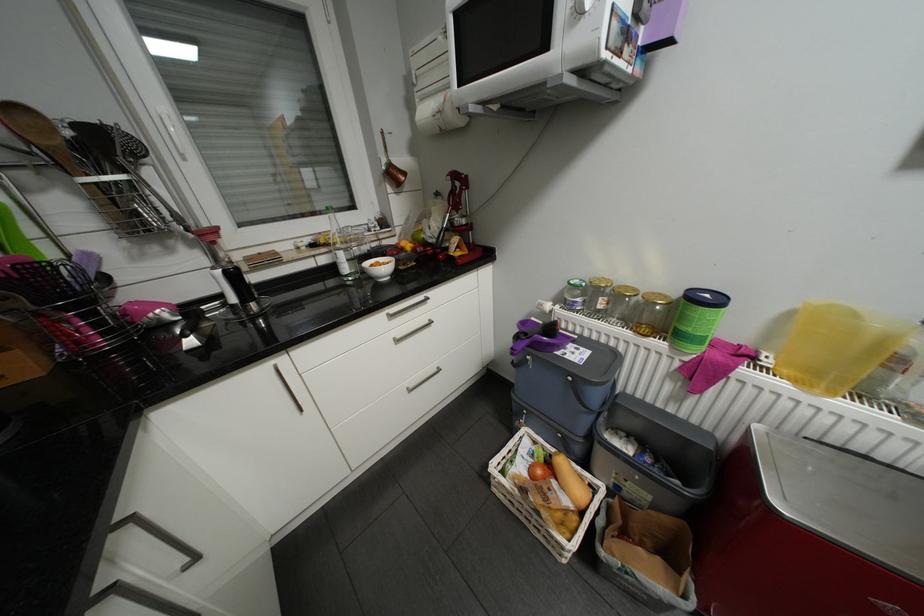
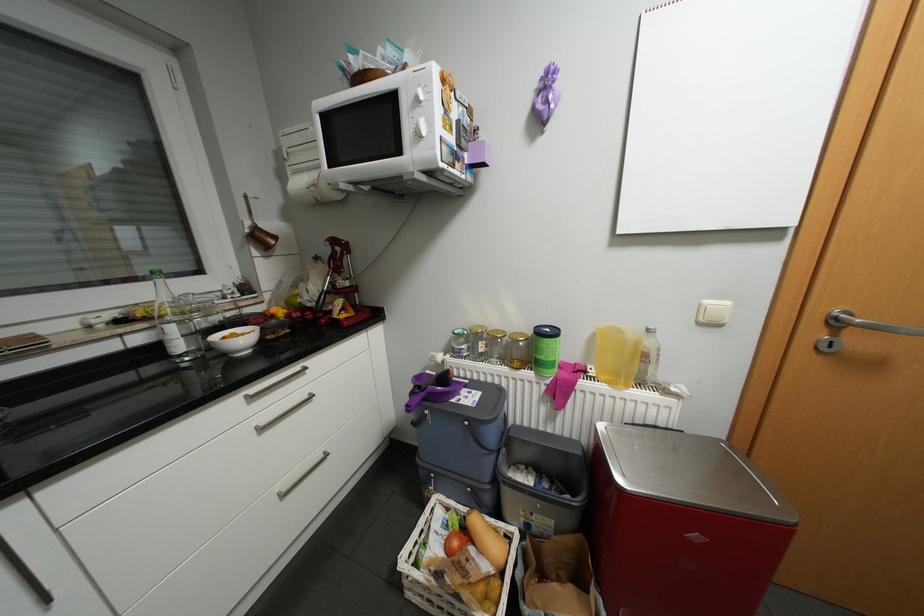
The point at (392,159) is marked in the first image. Where is the corresponding point in the second image?

(256, 223)